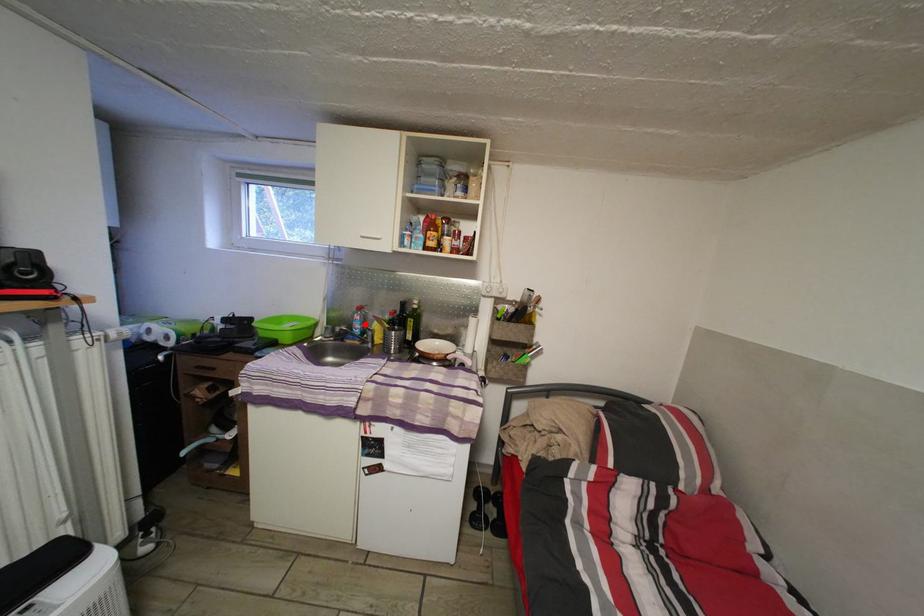
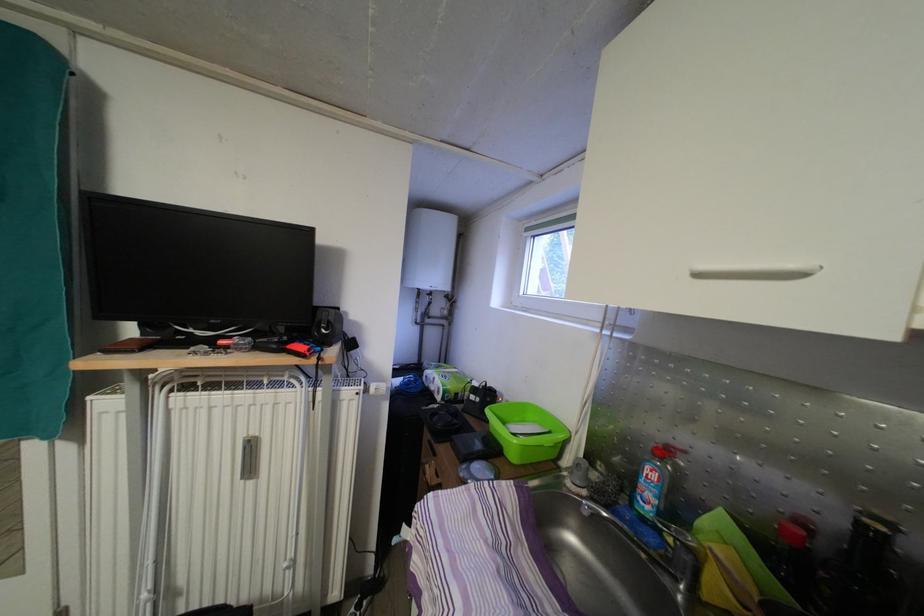
In the second image, find the point that corresponds to the highlighted location in the first image.

(661, 484)